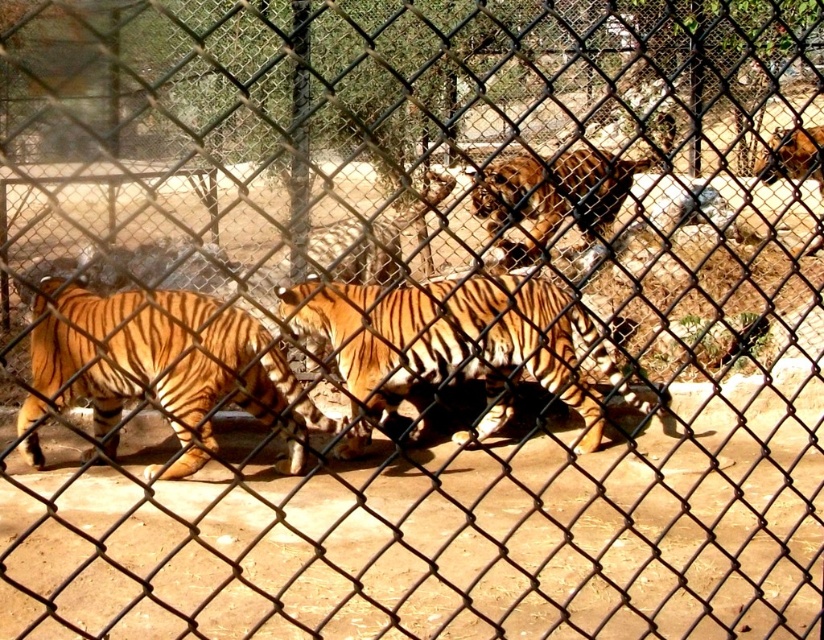
Can you confirm if orange striped tiger at center is taller than orange striped tiger at left?

No.

Does orange striped tiger at center have a larger size compared to orange striped tiger at left?

Correct, orange striped tiger at center is larger in size than orange striped tiger at left.

Who is more forward, (406, 353) or (322, 428)?

Point (322, 428)

Find the location of `orange striped tiger at center`. orange striped tiger at center is located at coordinates (455, 346).